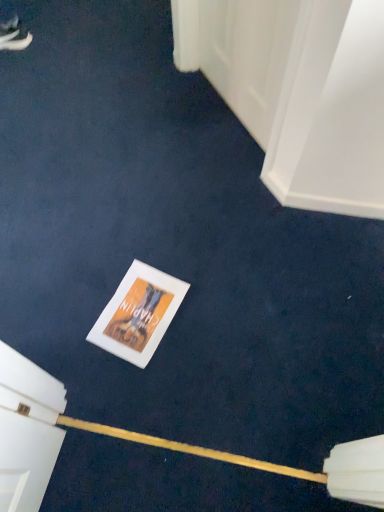
Image resolution: width=384 pixels, height=512 pixels. Describe the element at coordinates (138, 314) in the screenshot. I see `white glossy picture frame at center` at that location.

Locate an element on the screen. This screenshot has height=512, width=384. white glossy picture frame at center is located at coordinates (138, 314).

Image resolution: width=384 pixels, height=512 pixels. Find the location of `white glossy picture frame at center`. white glossy picture frame at center is located at coordinates (138, 314).